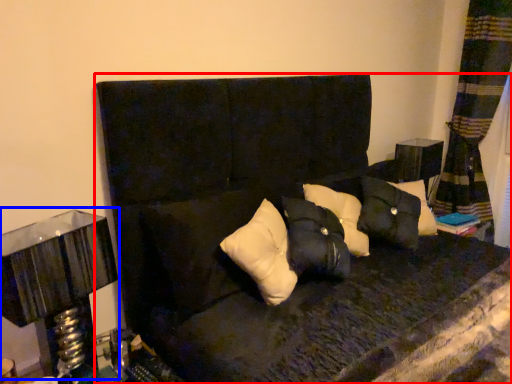
Question: Which point is closer to the camera, furniture (highlighted by a red box) or table lamp (highlighted by a blue box)?

Choices:
 (A) furniture
 (B) table lamp

Answer: (A)